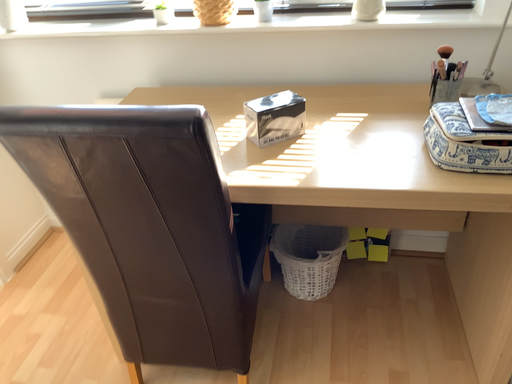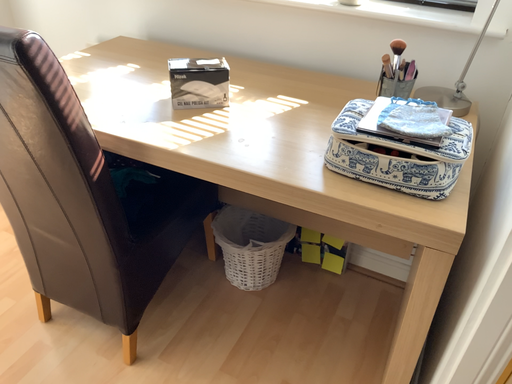
Question: Which way did the camera rotate in the video?

Choices:
 (A) rotated right
 (B) rotated left

Answer: (B)